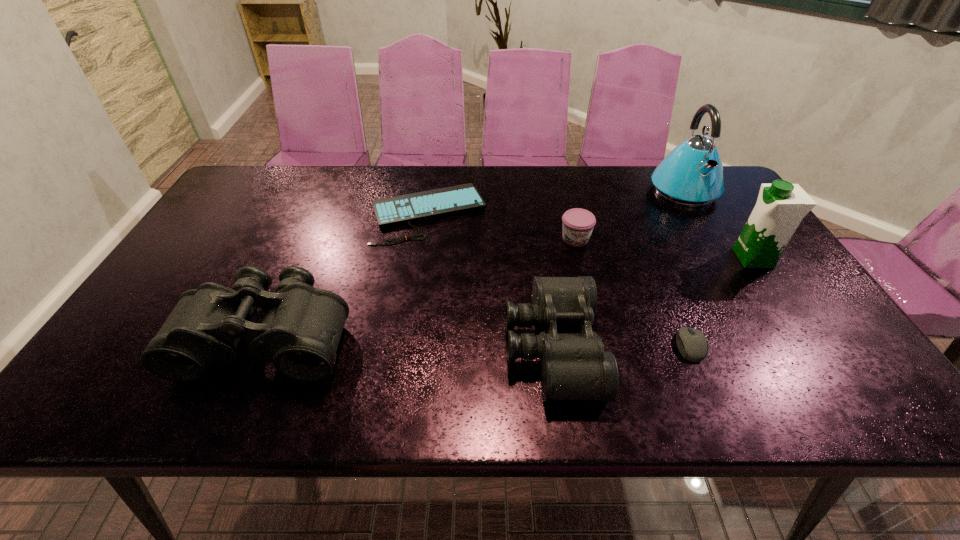
Locate which object is the third closest to the tallest object. Please provide its 2D coordinates. Your answer should be formatted as a tuple, i.e. [(x, y)], where the tuple contains the x and y coordinates of a point satisfying the conditions above.

[(574, 366)]

You are a GUI agent. You are given a task and a screenshot of the screen. Output one action in this format:
    pyautogui.click(x=<x>, y=<y>)
    Task: Click on the vacant space that satisfies the following two spatial constraints: 1. at the spout of the tallest object; 2. at the eyepieces of the shorter binoculars
    Image resolution: width=960 pixels, height=540 pixels.
    Given the screenshot: What is the action you would take?
    pyautogui.click(x=778, y=347)

The image size is (960, 540). Find the location of `free space in the image that satisfies the following two spatial constraints: 1. on the front label of the jam; 2. at the eyepieces of the right binoculars`. free space in the image that satisfies the following two spatial constraints: 1. on the front label of the jam; 2. at the eyepieces of the right binoculars is located at coordinates (602, 347).

Where is `free space that satisfies the following two spatial constraints: 1. on the front side of the fifth object from left to right; 2. at the eyepieces of the shorter binoculars`? This screenshot has height=540, width=960. free space that satisfies the following two spatial constraints: 1. on the front side of the fifth object from left to right; 2. at the eyepieces of the shorter binoculars is located at coordinates click(x=690, y=347).